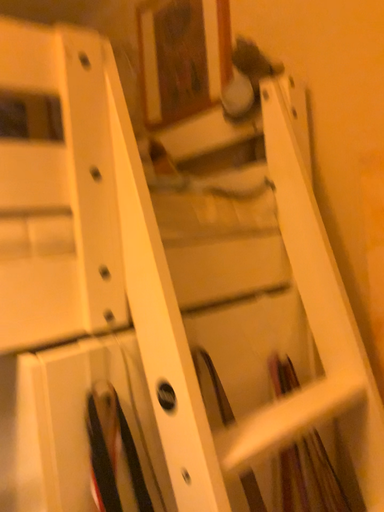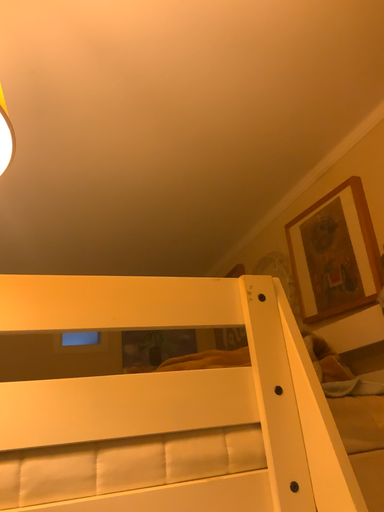
Question: Which way did the camera rotate in the video?

Choices:
 (A) rotated upward
 (B) rotated downward

Answer: (A)